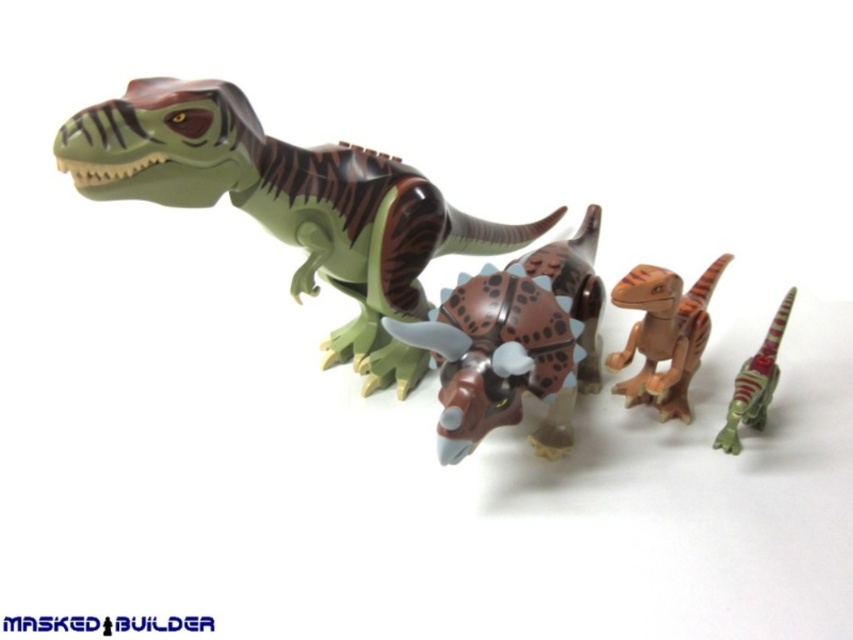
Who is taller, brown matte/studded triceratops at center or shiny green plastic dinosaur at lower right?

brown matte/studded triceratops at center is taller.

Can you confirm if brown matte/studded triceratops at center is wider than shiny green plastic dinosaur at lower right?

Correct, the width of brown matte/studded triceratops at center exceeds that of shiny green plastic dinosaur at lower right.

Describe the element at coordinates (498, 356) in the screenshot. This screenshot has height=640, width=853. I see `brown matte/studded triceratops at center` at that location.

Where is `brown matte/studded triceratops at center`? The width and height of the screenshot is (853, 640). brown matte/studded triceratops at center is located at coordinates (498, 356).

Who is more forward, (660, 355) or (729, 448)?

Positioned in front is point (729, 448).

Who is positioned more to the left, brown matte dinosaur at center or shiny green plastic dinosaur at lower right?

Positioned to the left is brown matte dinosaur at center.

Is point (705, 328) behind point (780, 301)?

Yes.

Find the location of a particular element. This screenshot has height=640, width=853. brown matte dinosaur at center is located at coordinates (663, 333).

Does brown matte/studded triceratops at center appear on the left side of brown matte triceratops at center?

Correct, you'll find brown matte/studded triceratops at center to the left of brown matte triceratops at center.

What do you see at coordinates (498, 356) in the screenshot? The image size is (853, 640). I see `brown matte/studded triceratops at center` at bounding box center [498, 356].

Where is `brown matte/studded triceratops at center`? brown matte/studded triceratops at center is located at coordinates (498, 356).

The height and width of the screenshot is (640, 853). I want to click on brown matte/studded triceratops at center, so click(x=498, y=356).